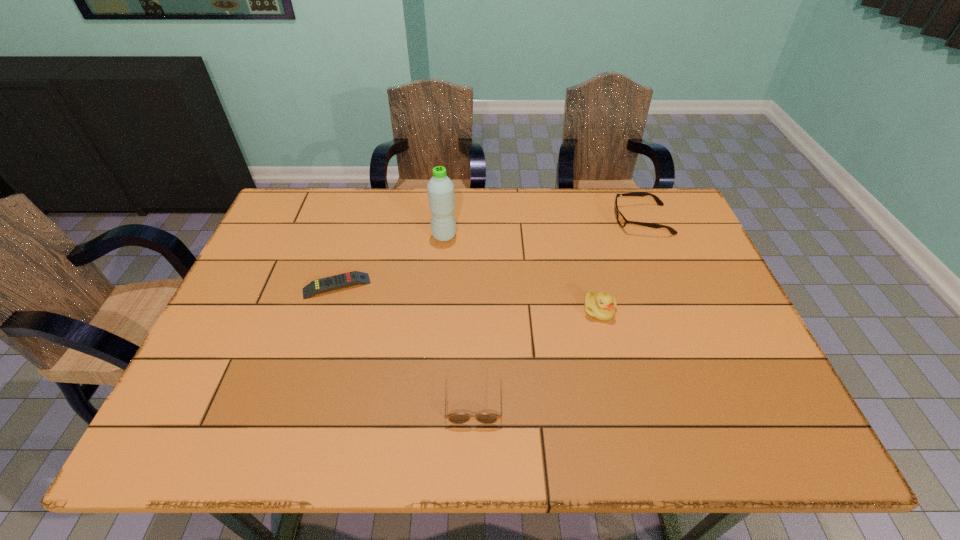
Locate an element on the screen. free space between the remote control and the rightmost object is located at coordinates (490, 253).

You are a GUI agent. You are given a task and a screenshot of the screen. Output one action in this format:
    pyautogui.click(x=<x>, y=<y>)
    Task: Click on the vacant area that lies between the sunglasses and the spectacles
    
    Given the screenshot: What is the action you would take?
    pyautogui.click(x=558, y=309)

The width and height of the screenshot is (960, 540). What are the coordinates of `free space between the sunglasses and the second object from right to left` in the screenshot? It's located at (536, 354).

Identify the location of unoccupied area between the spectacles and the shortest object. (490, 253).

Locate an element on the screen. vacant area that lies between the fourth shortest object and the tallest object is located at coordinates (521, 273).

At what (x,y) coordinates should I click in order to perform the action: click on vacant space that is in between the water bottle and the spectacles. Please return your answer as a coordinate pair (x, y). Looking at the image, I should click on (543, 228).

You are a GUI agent. You are given a task and a screenshot of the screen. Output one action in this format:
    pyautogui.click(x=<x>, y=<y>)
    Task: Click on the object identified as the closest to the rightmost object
    Image resolution: width=960 pixels, height=540 pixels.
    Given the screenshot: What is the action you would take?
    pyautogui.click(x=601, y=306)

Identify which object is located as the second nearest to the shortest object. Please provide its 2D coordinates. Your answer should be formatted as a tuple, i.e. [(x, y)], where the tuple contains the x and y coordinates of a point satisfying the conditions above.

[(457, 418)]